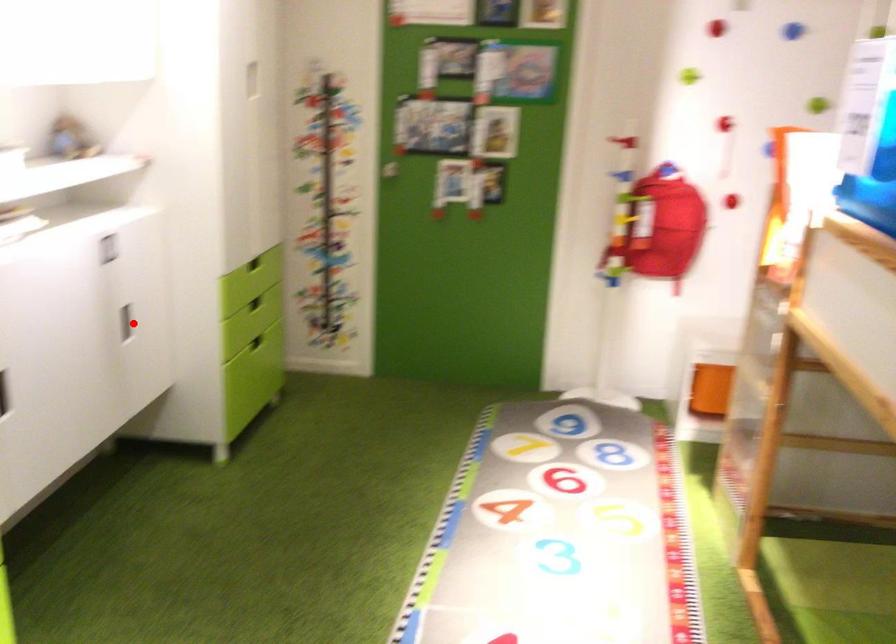
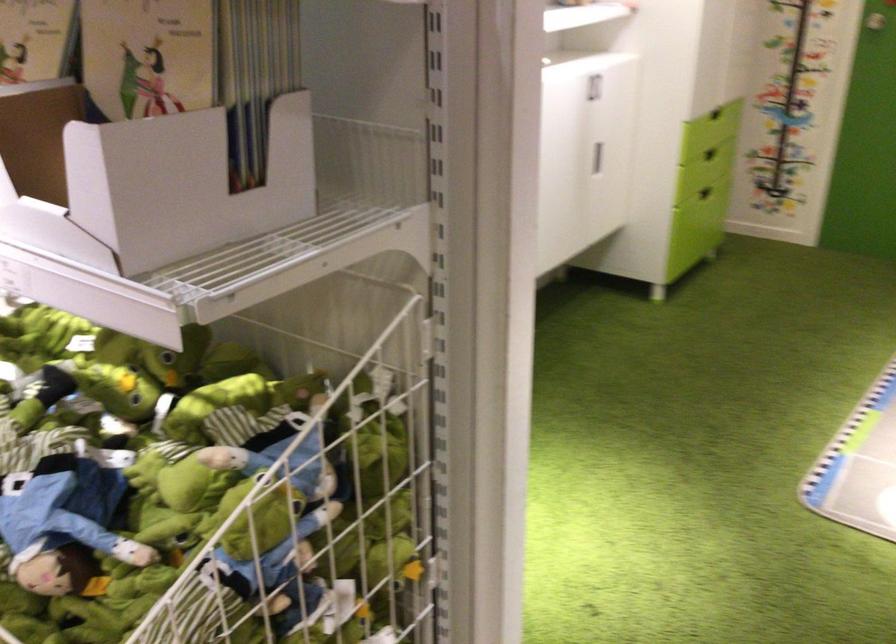
Where in the second image is the point corresponding to the highlighted location from the first image?

(597, 158)